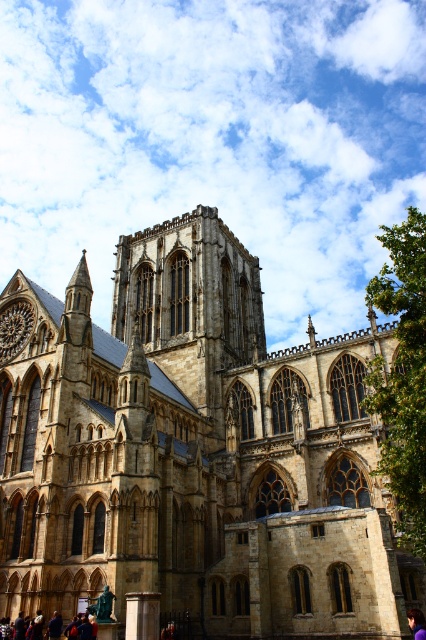
Which is in front, point (333, 561) or point (414, 620)?

Point (414, 620) is in front.

Describe the element at coordinates (193, 451) in the screenshot. I see `brown stone church at center` at that location.

At what (x,y) coordinates should I click in order to perform the action: click on brown stone church at center. Please return your answer as a coordinate pair (x, y). Looking at the image, I should click on (193, 451).